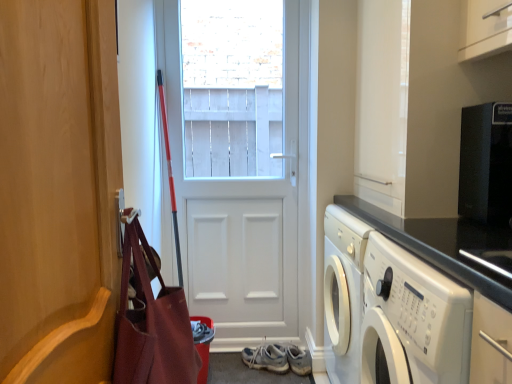
Question: Is wooden door at left, placed as the 1th door when sorted from front to back, wider than white matte door at center, acting as the 2th door starting from the front?

Choices:
 (A) no
 (B) yes

Answer: (A)

Question: Is wooden door at left, positioned as the 2th door in back-to-front order, not within white matte door at center, acting as the 2th door starting from the front?

Choices:
 (A) yes
 (B) no

Answer: (A)

Question: Is wooden door at left, placed as the 1th door when sorted from front to back, with white matte door at center, the 1th door in the back-to-front sequence?

Choices:
 (A) yes
 (B) no

Answer: (B)

Question: Can white matte door at center, the 1th door in the back-to-front sequence, be found inside wooden door at left, positioned as the 2th door in back-to-front order?

Choices:
 (A) yes
 (B) no

Answer: (B)

Question: Is wooden door at left, placed as the 1th door when sorted from front to back, positioned behind white matte door at center, acting as the 2th door starting from the front?

Choices:
 (A) no
 (B) yes

Answer: (A)

Question: Does wooden door at left, positioned as the 2th door in back-to-front order, have a lesser width compared to white matte door at center, the 1th door in the back-to-front sequence?

Choices:
 (A) no
 (B) yes

Answer: (B)

Question: Is black matte microwave at upper right aimed at leather-like brown bag at left?

Choices:
 (A) yes
 (B) no

Answer: (A)

Question: From a real-world perspective, is black matte microwave at upper right on leather-like brown bag at left?

Choices:
 (A) yes
 (B) no

Answer: (A)

Question: Is black matte microwave at upper right beside leather-like brown bag at left?

Choices:
 (A) yes
 (B) no

Answer: (B)

Question: Is black matte microwave at upper right to the left of leather-like brown bag at left from the viewer's perspective?

Choices:
 (A) no
 (B) yes

Answer: (A)

Question: Does black matte microwave at upper right have a larger size compared to leather-like brown bag at left?

Choices:
 (A) yes
 (B) no

Answer: (B)

Question: From a real-world perspective, is black matte microwave at upper right below leather-like brown bag at left?

Choices:
 (A) yes
 (B) no

Answer: (B)

Question: From the image's perspective, is light blue fabric sneakers at center beneath white glossy washing machine at lower right?

Choices:
 (A) yes
 (B) no

Answer: (A)